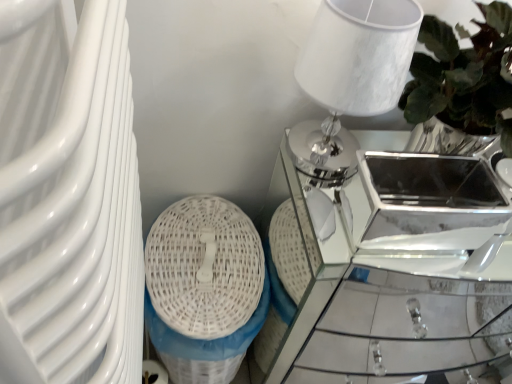
Question: Which is correct: white wicker basket at lower left is inside mirror glass table at center, or outside of it?

Choices:
 (A) outside
 (B) inside

Answer: (A)

Question: In terms of size, does white wicker basket at lower left appear bigger or smaller than mirror glass table at center?

Choices:
 (A) big
 (B) small

Answer: (B)

Question: Which object is positioned farthest from the mirror glass table at center?

Choices:
 (A) white wicker basket at lower left
 (B) white marble table lamp at upper right

Answer: (B)

Question: Which is farther from the white marble table lamp at upper right?

Choices:
 (A) mirror glass table at center
 (B) white wicker basket at lower left

Answer: (A)